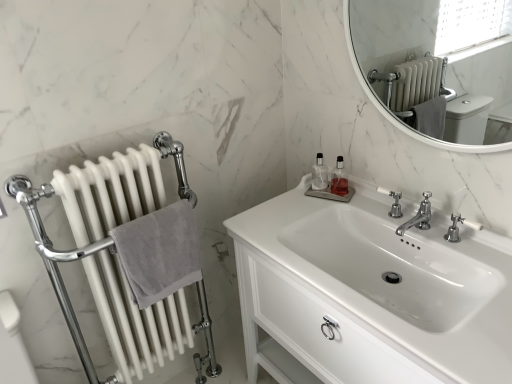
Where is `blank space to the left of polished chrome faucet at upper right`? blank space to the left of polished chrome faucet at upper right is located at coordinates (347, 213).